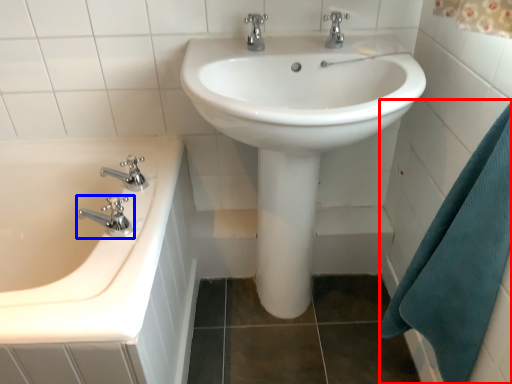
Question: Which object appears closest to the camera in this image, bath towel (highlighted by a red box) or tap (highlighted by a blue box)?

Choices:
 (A) bath towel
 (B) tap

Answer: (A)